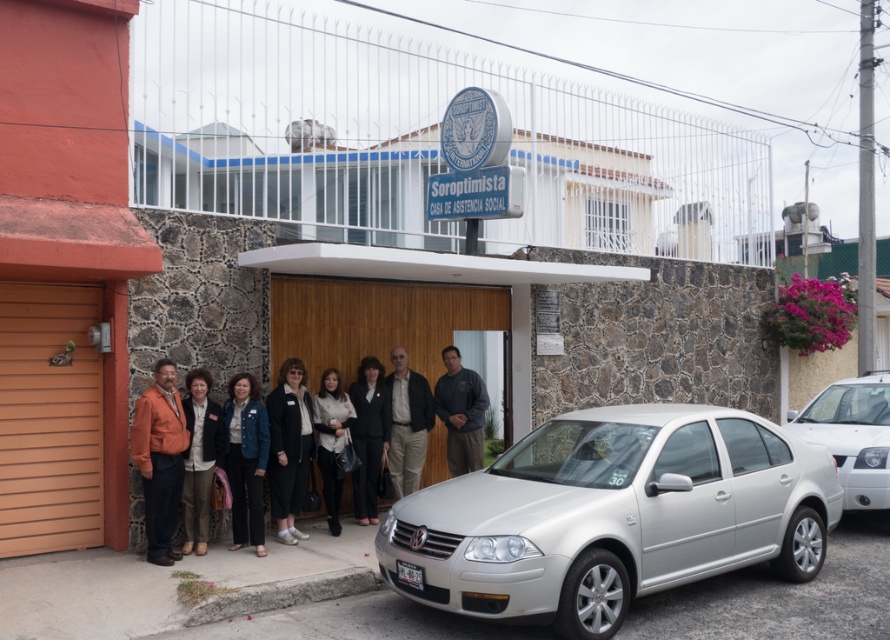
Is silver metallic sedan at center taller than orange fabric jacket at left?

Incorrect, silver metallic sedan at center's height is not larger of orange fabric jacket at left's.

Is the position of silver metallic sedan at center more distant than that of orange fabric jacket at left?

That is True.

The height and width of the screenshot is (640, 890). What do you see at coordinates (852, 435) in the screenshot?
I see `silver metallic sedan at center` at bounding box center [852, 435].

You are a GUI agent. You are given a task and a screenshot of the screen. Output one action in this format:
    pyautogui.click(x=<x>, y=<y>)
    Task: Click on the silver metallic sedan at center
    The height and width of the screenshot is (640, 890).
    Given the screenshot: What is the action you would take?
    pyautogui.click(x=852, y=435)

The image size is (890, 640). Describe the element at coordinates (159, 458) in the screenshot. I see `orange fabric jacket at left` at that location.

Which is below, orange fabric jacket at left or black matte blazer at center?

black matte blazer at center is lower down.

Which is in front, point (156, 433) or point (267, 404)?

Point (156, 433) is more forward.

This screenshot has width=890, height=640. Find the location of `orange fabric jacket at left`. orange fabric jacket at left is located at coordinates (159, 458).

Consider the image. Who is higher up, light brown leather jacket at center or black leather jacket at center?

Positioned higher is light brown leather jacket at center.

Can you confirm if light brown leather jacket at center is bigger than black leather jacket at center?

No.

This screenshot has height=640, width=890. I want to click on light brown leather jacket at center, so click(199, 458).